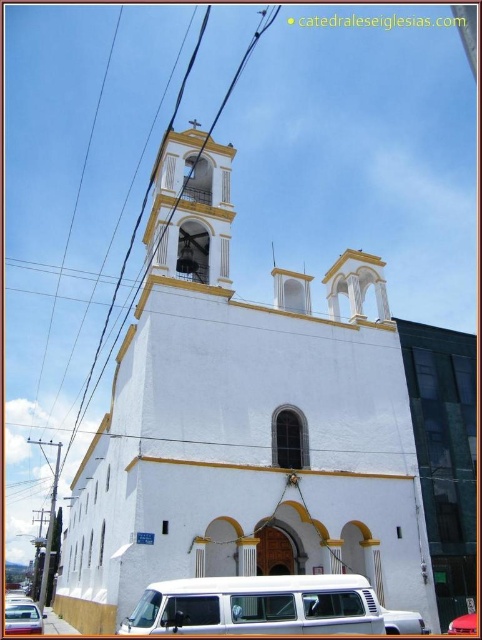
Does white matte van at center lie in front of metallic silver van at center?

Yes, white matte van at center is closer to the viewer.

Can you confirm if white matte van at center is thinner than metallic silver van at center?

No.

Is point (405, 621) closer to camera compared to point (472, 627)?

That is True.

Identify the location of white matte van at center. This screenshot has height=640, width=482. (267, 605).

Who is lower down, white matte van at center or metallic silver van at lower left?

Positioned lower is metallic silver van at lower left.

Is point (295, 588) closer to camera compared to point (13, 624)?

That is True.

At what (x,y) coordinates should I click in order to perform the action: click on white matte van at center. Please return your answer as a coordinate pair (x, y). This screenshot has width=482, height=640. Looking at the image, I should click on (267, 605).

Is the position of white smooth bell tower at upper center less distant than that of white matte van at center?

No, white smooth bell tower at upper center is behind white matte van at center.

Between point (214, 145) and point (343, 582), which one is positioned in front?

Point (343, 582)

This screenshot has width=482, height=640. Find the location of `white smooth bell tower at upper center`. white smooth bell tower at upper center is located at coordinates (243, 424).